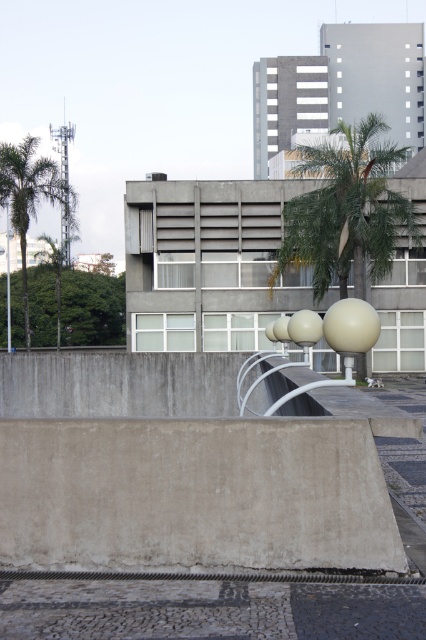
You are a landscape architect planning to install a new pathway between the concrete at center and the green leafy palm tree at left. The pathway requires a minimum of 30 meters of space. Can the available distance accommodate this requirement?

The distance between the concrete at center and the green leafy palm tree at left is 33.74 meters, which exceeds the required 30 meters. Therefore, the available space can accommodate the pathway.

Consider the image. You are standing on the raised platform near the concrete at center and want to reach the green leafy palm tree at left. Which direction should you move to get closer to the tree?

To reach the green leafy palm tree at left, you should move upward since the concrete at center is below it.